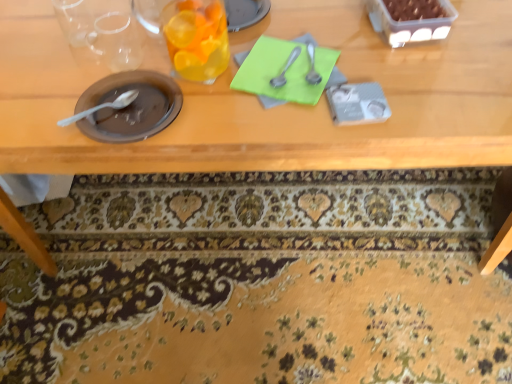
Question: Can you confirm if satin silver spoon at upper center, the 4th tableware when ordered from left to right, is wider than matte brown plate at left, the fourth tableware viewed from the right?

Choices:
 (A) yes
 (B) no

Answer: (B)

Question: Is satin silver spoon at upper center, the first tableware in the right-to-left sequence, positioned in front of matte brown plate at left, the fourth tableware viewed from the right?

Choices:
 (A) yes
 (B) no

Answer: (B)

Question: Is satin silver spoon at upper center, the first tableware in the right-to-left sequence, with matte brown plate at left, the first tableware viewed from the left?

Choices:
 (A) no
 (B) yes

Answer: (A)

Question: Does satin silver spoon at upper center, the first tableware in the right-to-left sequence, contain matte brown plate at left, the fourth tableware viewed from the right?

Choices:
 (A) yes
 (B) no

Answer: (B)

Question: From the image's perspective, is satin silver spoon at upper center, the first tableware in the right-to-left sequence, located beneath matte brown plate at left, the fourth tableware viewed from the right?

Choices:
 (A) yes
 (B) no

Answer: (B)

Question: Considering the relative sizes of satin silver spoon at upper center, the first tableware in the right-to-left sequence, and matte brown plate at left, the first tableware viewed from the left, in the image provided, is satin silver spoon at upper center, the first tableware in the right-to-left sequence, bigger than matte brown plate at left, the first tableware viewed from the left,?

Choices:
 (A) yes
 (B) no

Answer: (B)

Question: Can you confirm if translucent glass at upper center, the second tableware when ordered from left to right, is shorter than satin silver spoon at upper center, the first tableware in the right-to-left sequence?

Choices:
 (A) no
 (B) yes

Answer: (A)

Question: Is translucent glass at upper center, the second tableware when ordered from left to right, positioned beyond the bounds of satin silver spoon at upper center, the 4th tableware when ordered from left to right?

Choices:
 (A) yes
 (B) no

Answer: (A)

Question: Does translucent glass at upper center, which is the 3th tableware from right to left, have a greater width compared to satin silver spoon at upper center, the 4th tableware when ordered from left to right?

Choices:
 (A) no
 (B) yes

Answer: (B)

Question: Is translucent glass at upper center, the second tableware when ordered from left to right, next to satin silver spoon at upper center, the 4th tableware when ordered from left to right?

Choices:
 (A) yes
 (B) no

Answer: (B)

Question: Is translucent glass at upper center, the second tableware when ordered from left to right, far from satin silver spoon at upper center, the 4th tableware when ordered from left to right?

Choices:
 (A) no
 (B) yes

Answer: (A)

Question: Does translucent glass at upper center, the second tableware when ordered from left to right, have a larger size compared to satin silver spoon at upper center, the 4th tableware when ordered from left to right?

Choices:
 (A) yes
 (B) no

Answer: (A)

Question: Considering the relative sizes of green paper at center and wooden table at center in the image provided, is green paper at center taller than wooden table at center?

Choices:
 (A) no
 (B) yes

Answer: (A)